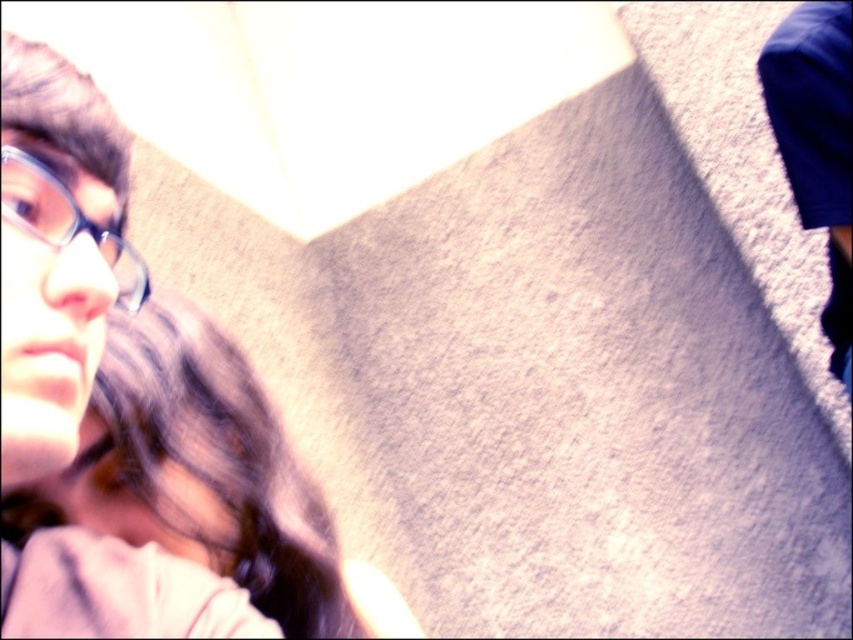
You are standing at the origin point in the image. There are two points marked in the scene, point (196, 525) and point (32, 212). Which point is closer to you?

Point (32, 212) is closer to you because it is in front of point (196, 525).

You are a photographer trying to frame a portrait. You see a smooth skin face at left and matte black glasses at left in the scene. Which object should you adjust your camera to focus on if you want to capture the wider object?

The smooth skin face at left might be wider than matte black glasses at left, so you should focus on the smooth skin face at left to capture the wider object.